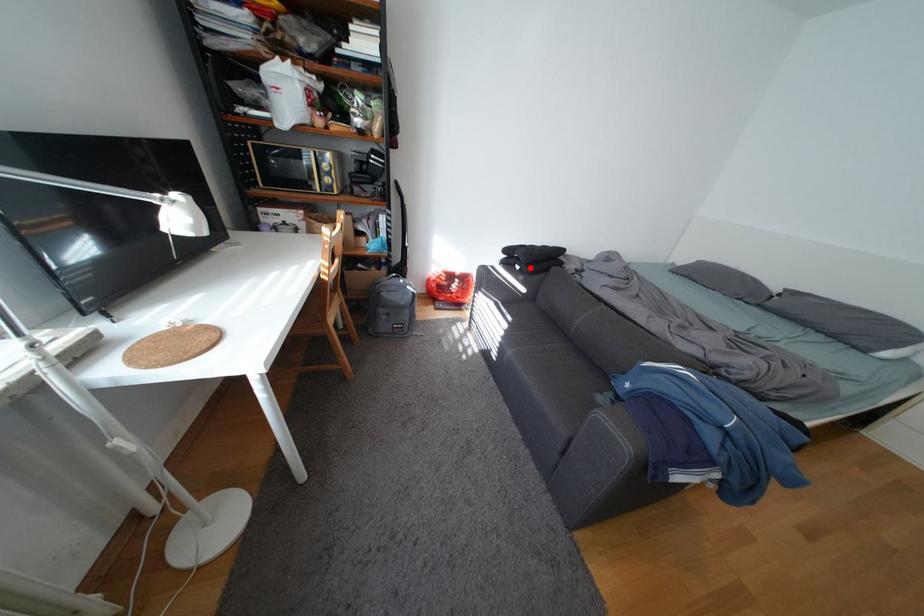
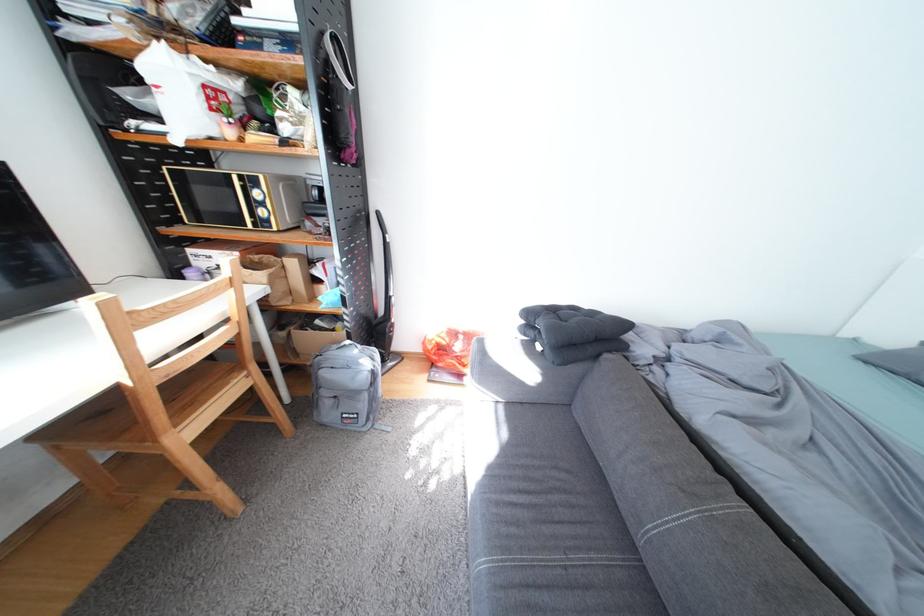
Locate, in the second image, the point that corresponds to the highlighted location in the first image.

(552, 347)